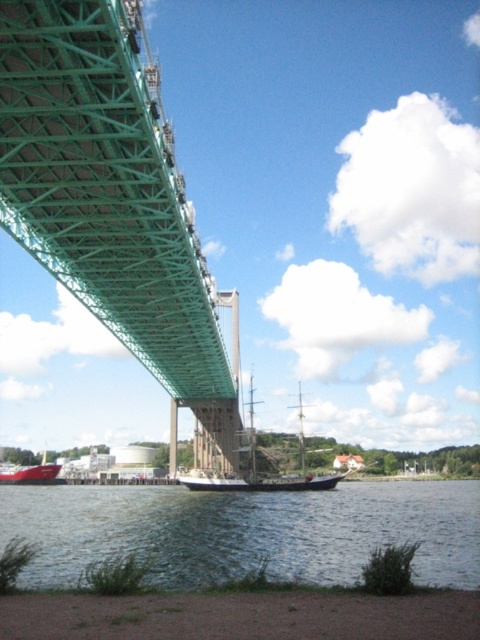
In the scene shown: Between green metallic suspension bridge at upper left and wooden sailboat at center, which one appears on the left side from the viewer's perspective?

From the viewer's perspective, green metallic suspension bridge at upper left appears more on the left side.

Does green metallic suspension bridge at upper left have a lesser height compared to wooden sailboat at center?

No.

Where is `green metallic suspension bridge at upper left`? This screenshot has height=640, width=480. green metallic suspension bridge at upper left is located at coordinates (113, 202).

Which is more to the left, smooth water at lower center or wooden sailboat at center?

From the viewer's perspective, smooth water at lower center appears more on the left side.

Is smooth water at lower center in front of wooden sailboat at center?

Yes, it is in front of wooden sailboat at center.

This screenshot has height=640, width=480. I want to click on smooth water at lower center, so click(247, 531).

Can you confirm if wooden sailboat at center is thinner than matte red boat at lower left?

In fact, wooden sailboat at center might be wider than matte red boat at lower left.

Can you confirm if wooden sailboat at center is smaller than matte red boat at lower left?

Actually, wooden sailboat at center might be larger than matte red boat at lower left.

This screenshot has height=640, width=480. What do you see at coordinates (261, 483) in the screenshot?
I see `wooden sailboat at center` at bounding box center [261, 483].

Where is `wooden sailboat at center`? The width and height of the screenshot is (480, 640). wooden sailboat at center is located at coordinates 261,483.